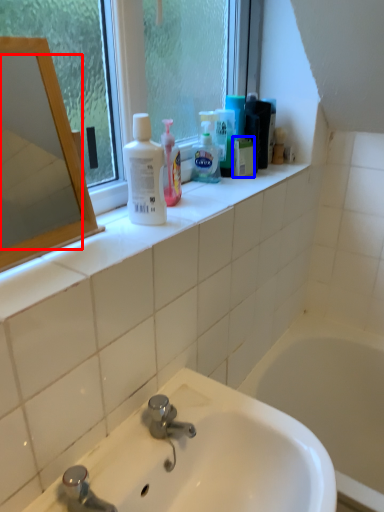
Question: Among these objects, which one is farthest to the camera, mirror (highlighted by a red box) or mouthwash (highlighted by a blue box)?

Choices:
 (A) mirror
 (B) mouthwash

Answer: (B)